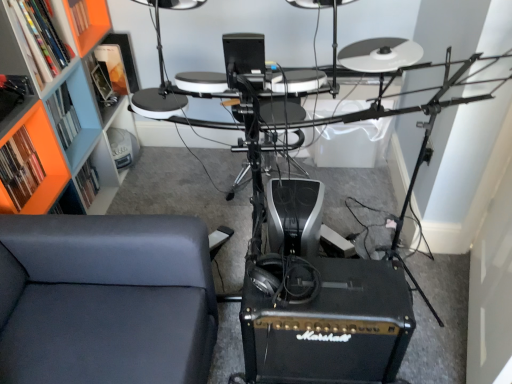
Question: From the image's perspective, is black leather armchair at center under orange plastic shelf at upper left, which is counted as the 1th shelf, starting from the top?

Choices:
 (A) yes
 (B) no

Answer: (A)

Question: Can you confirm if black leather armchair at center is smaller than orange plastic shelf at upper left, which is counted as the 1th shelf, starting from the top?

Choices:
 (A) no
 (B) yes

Answer: (A)

Question: Does black leather armchair at center have a lesser height compared to orange plastic shelf at upper left, which is counted as the 1th shelf, starting from the top?

Choices:
 (A) no
 (B) yes

Answer: (A)

Question: Is orange plastic shelf at upper left, which is counted as the 1th shelf, starting from the top, located within black leather armchair at center?

Choices:
 (A) yes
 (B) no

Answer: (B)

Question: Is black leather armchair at center positioned beyond the bounds of orange plastic shelf at upper left, which is counted as the 1th shelf, starting from the top?

Choices:
 (A) yes
 (B) no

Answer: (A)

Question: Is black leather armchair at center in front of orange plastic shelf at upper left, which is counted as the 1th shelf, starting from the top?

Choices:
 (A) yes
 (B) no

Answer: (B)

Question: Is orange matte bookshelf at upper left, the second shelf from the bottom, not within suede-like gray chair at lower left?

Choices:
 (A) no
 (B) yes

Answer: (B)

Question: Is orange matte bookshelf at upper left, the third shelf positioned from the top, far from suede-like gray chair at lower left?

Choices:
 (A) no
 (B) yes

Answer: (A)

Question: Is orange matte bookshelf at upper left, the third shelf positioned from the top, behind suede-like gray chair at lower left?

Choices:
 (A) yes
 (B) no

Answer: (A)

Question: Considering the relative positions of orange matte bookshelf at upper left, the second shelf from the bottom, and suede-like gray chair at lower left in the image provided, is orange matte bookshelf at upper left, the second shelf from the bottom, to the right of suede-like gray chair at lower left from the viewer's perspective?

Choices:
 (A) no
 (B) yes

Answer: (A)

Question: From the image's perspective, is orange matte bookshelf at upper left, the third shelf positioned from the top, on suede-like gray chair at lower left?

Choices:
 (A) yes
 (B) no

Answer: (A)

Question: From the image's perspective, would you say orange matte bookshelf at upper left, the second shelf from the bottom, is shown under suede-like gray chair at lower left?

Choices:
 (A) yes
 (B) no

Answer: (B)

Question: From a real-world perspective, is black leather armchair at center located higher than orange matte bookshelf at upper left, the first shelf ordered from the bottom?

Choices:
 (A) no
 (B) yes

Answer: (A)